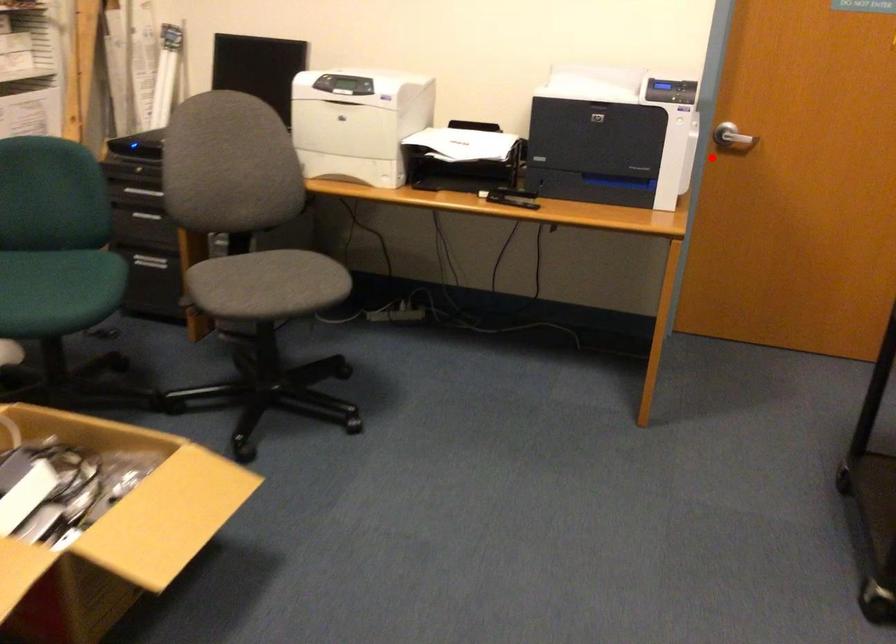
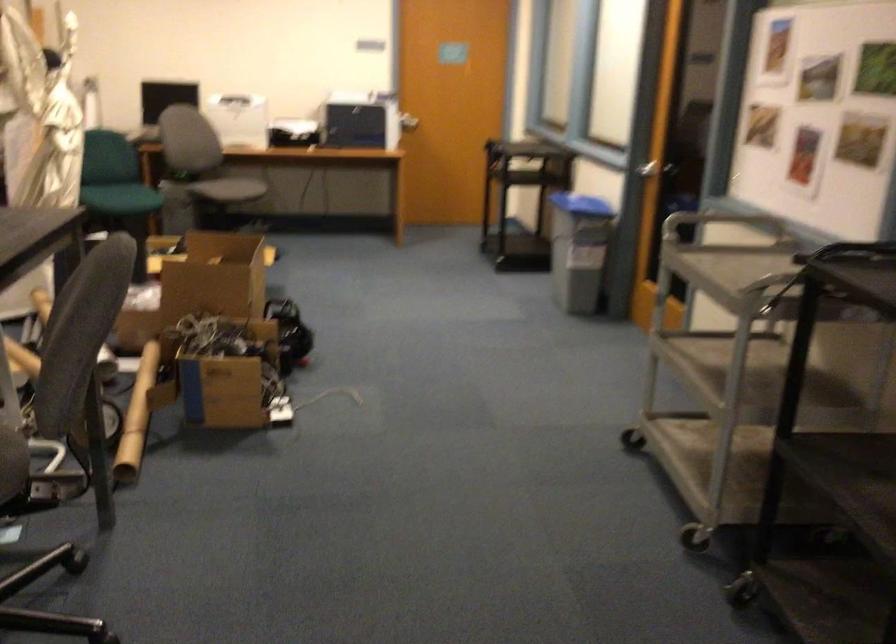
Where in the second image is the point corresponding to the highlighted location from the first image?

(409, 122)